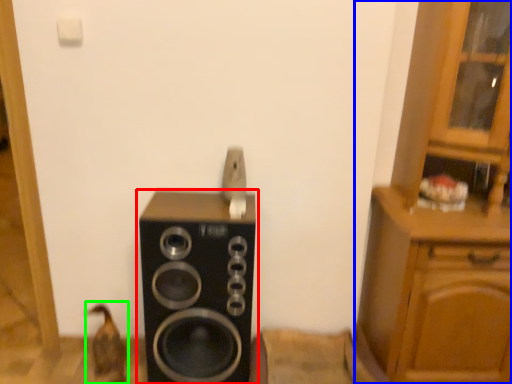
Question: Based on their relative distances, which object is nearer to home appliance (highlighted by a red box)? Choose from cabinetry (highlighted by a blue box) and animal (highlighted by a green box).

Choices:
 (A) cabinetry
 (B) animal

Answer: (B)